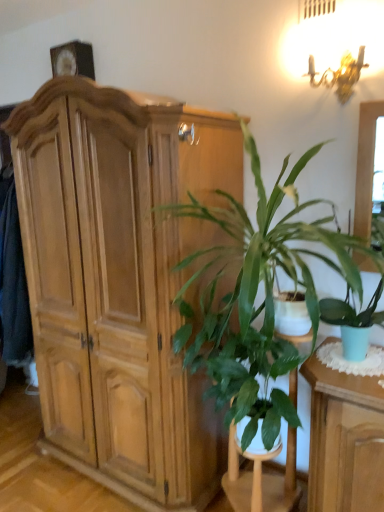
Question: Is green leafy plant at center wider or thinner than green glossy plant at center?

Choices:
 (A) wide
 (B) thin

Answer: (B)

Question: In terms of size, does green leafy plant at center appear bigger or smaller than green glossy plant at center?

Choices:
 (A) big
 (B) small

Answer: (B)

Question: Which object is positioned closest to the green leafy plant at center?

Choices:
 (A) green glossy plant at center
 (B) light brown wood cabinet at left

Answer: (A)

Question: Which is nearer to the light brown wood cabinet at left?

Choices:
 (A) green leafy plant at center
 (B) green glossy plant at center

Answer: (B)